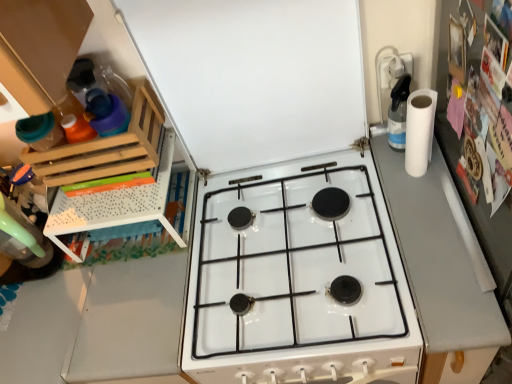
Locate an element on the screen. The height and width of the screenshot is (384, 512). vacant area in front of clear plastic spray bottle at upper right is located at coordinates point(415,201).